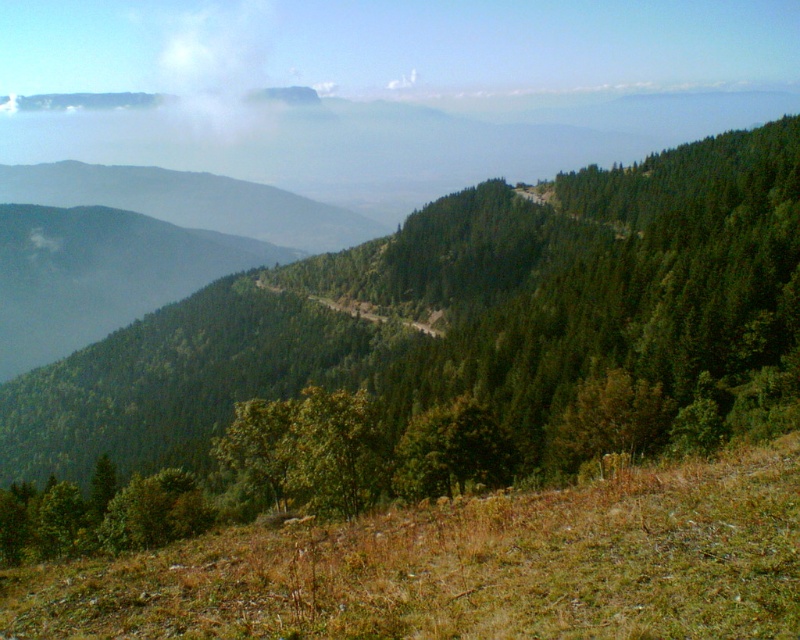
Based on the scene description, where exactly is the white fog at upper left located in the image?

The white fog at upper left is located at point coordinates of 0.105 on the x axis and 0.270 on the y axis.

You are a hiker planning to reach the cluster of structures on the ridge. You notice a point marked by coordinates in the image. What does the point at coordinates point (x=216, y=67) indicate that could affect your path?

The point at coordinates point (x=216, y=67) marks white fog at upper left, which could obscure visibility and make navigation challenging, potentially affecting your path to the structures on the ridge.